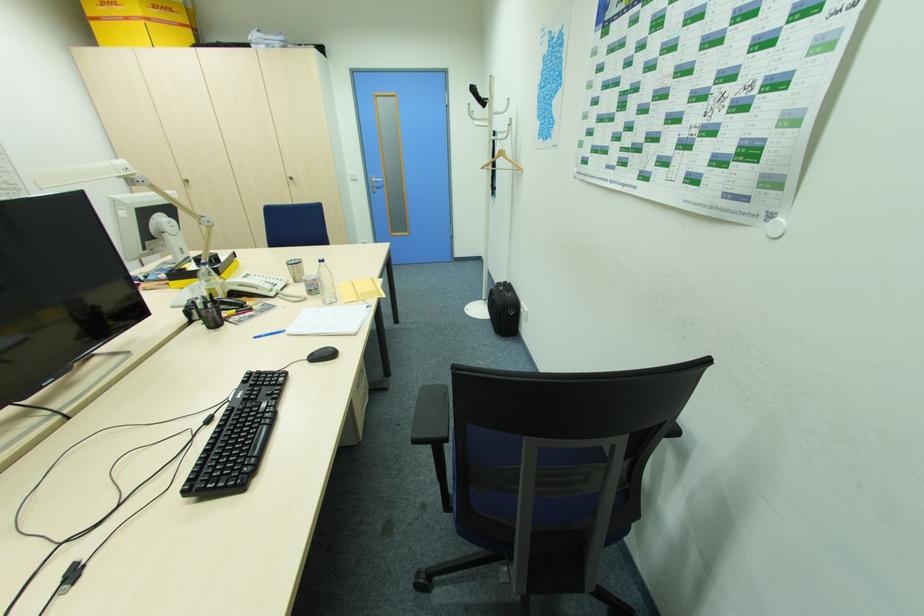
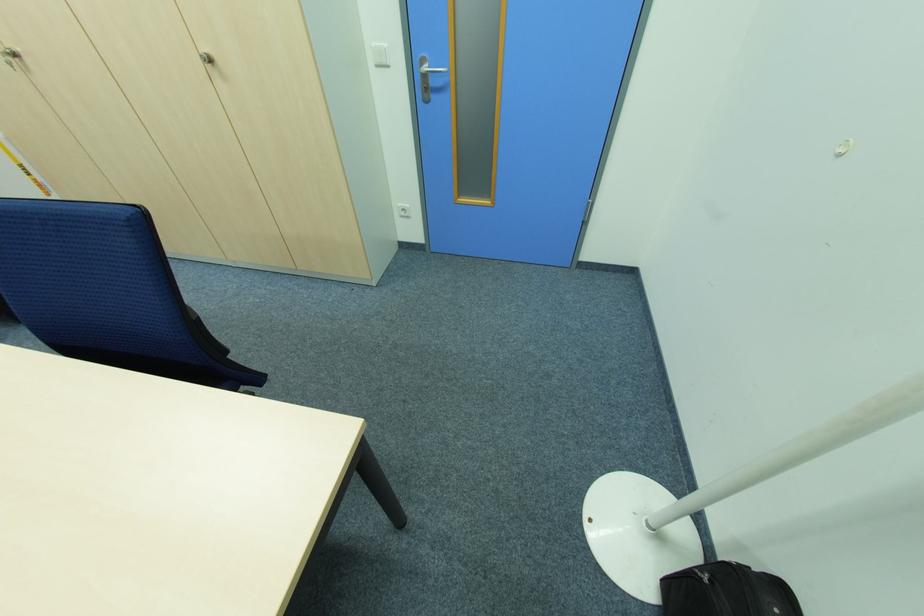
Where in the second image is the point corresponding to point 188,185 from the first image?

(14, 65)